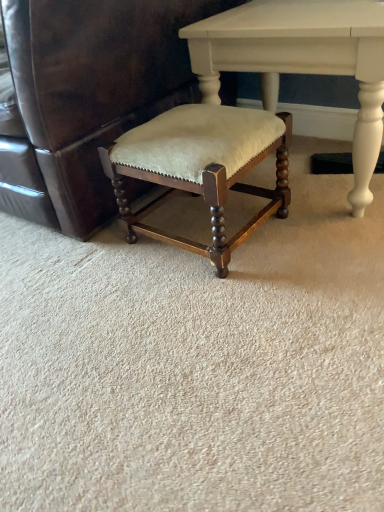
You are a GUI agent. You are given a task and a screenshot of the screen. Output one action in this format:
    pyautogui.click(x=<x>, y=<y>)
    Task: Click on the free space above velvet beige stool at center (from a real-world perspective)
    
    Given the screenshot: What is the action you would take?
    pyautogui.click(x=190, y=123)